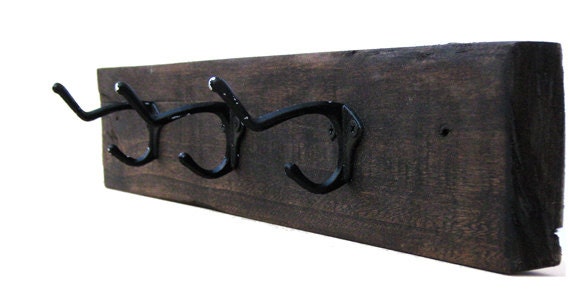
Locate an element on the screen. middle hanger is located at coordinates (146, 113).